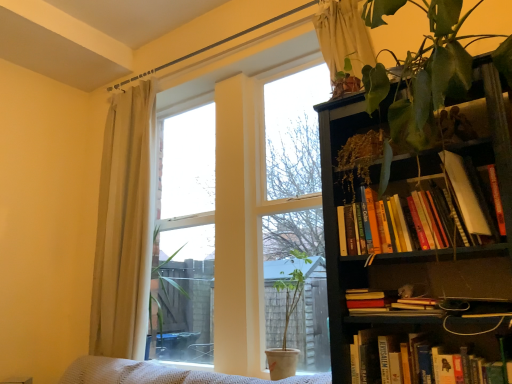
This screenshot has height=384, width=512. Describe the element at coordinates (343, 36) in the screenshot. I see `white sheer curtain at upper center, the second curtain from the left` at that location.

Image resolution: width=512 pixels, height=384 pixels. Describe the element at coordinates (287, 311) in the screenshot. I see `matte white pot at center` at that location.

The image size is (512, 384). What do you see at coordinates (124, 227) in the screenshot?
I see `beige fabric curtain at left, the first curtain from the left` at bounding box center [124, 227].

What do you see at coordinates (383, 356) in the screenshot? I see `hardcover book at lower right, which is the 2th book from top to bottom` at bounding box center [383, 356].

What do you see at coordinates (438, 216) in the screenshot? This screenshot has height=384, width=512. I see `hardcover books at upper right, the second book positioned from the bottom` at bounding box center [438, 216].

Where is `white sheer curtain at upper center, the 2th curtain when ordered from back to front`? white sheer curtain at upper center, the 2th curtain when ordered from back to front is located at coordinates (343, 36).

Which object is further away from the camera taking this photo, green leafy plant at upper right or beige fabric curtain at left, acting as the second curtain starting from the right?

beige fabric curtain at left, acting as the second curtain starting from the right, is further from the camera.

From a real-world perspective, is green leafy plant at upper right positioned over beige fabric curtain at left, acting as the second curtain starting from the right, based on gravity?

Yes, from a real-world perspective, green leafy plant at upper right is on top of beige fabric curtain at left, acting as the second curtain starting from the right.

Does point (403, 114) appear closer or farther from the camera than point (105, 290)?

Point (403, 114).

Is green leafy plant at upper right directly adjacent to beige fabric curtain at left, the second curtain in the front-to-back sequence?

No, green leafy plant at upper right is not touching beige fabric curtain at left, the second curtain in the front-to-back sequence.

Are beige fabric curtain at left, the first curtain from the left, and hardcover books at upper right, the second book positioned from the bottom, beside each other?

beige fabric curtain at left, the first curtain from the left, is not next to hardcover books at upper right, the second book positioned from the bottom, and they're not touching.

Does beige fabric curtain at left, acting as the second curtain starting from the right, have a greater height compared to hardcover books at upper right, the second book positioned from the bottom?

Indeed, beige fabric curtain at left, acting as the second curtain starting from the right, has a greater height compared to hardcover books at upper right, the second book positioned from the bottom.

Could you tell me if beige fabric curtain at left, acting as the second curtain starting from the right, is turned towards hardcover books at upper right, arranged as the 1th book when viewed from the top?

No, beige fabric curtain at left, acting as the second curtain starting from the right, does not turn towards hardcover books at upper right, arranged as the 1th book when viewed from the top.

Measure the distance from beige fabric curtain at left, the second curtain in the front-to-back sequence, to hardcover books at upper right, arranged as the 1th book when viewed from the top.

5.27 feet.

From the picture: Is transparent glass window at center wider than beige fabric curtain at left, the first curtain from the left?

Correct, the width of transparent glass window at center exceeds that of beige fabric curtain at left, the first curtain from the left.

From the image's perspective, between transparent glass window at center and beige fabric curtain at left, the first curtain from the left, which one is located above?

transparent glass window at center is shown above in the image.

Is the position of transparent glass window at center less distant than that of beige fabric curtain at left, the second curtain in the front-to-back sequence?

Yes, transparent glass window at center is closer to the camera.

Who is taller, transparent glass window at center or beige fabric curtain at left, the first curtain from the left?

Standing taller between the two is transparent glass window at center.

Considering the sizes of white sheer curtain at upper center, which ranks as the first curtain in front-to-back order, and transparent glass window at center in the image, is white sheer curtain at upper center, which ranks as the first curtain in front-to-back order, bigger or smaller than transparent glass window at center?

Considering their sizes, white sheer curtain at upper center, which ranks as the first curtain in front-to-back order, takes up less space than transparent glass window at center.

Which object is further away from the camera, white sheer curtain at upper center, which is the 1th curtain from right to left, or transparent glass window at center?

white sheer curtain at upper center, which is the 1th curtain from right to left, is further from the camera.

From a real-world perspective, which is physically below, white sheer curtain at upper center, the second curtain from the left, or transparent glass window at center?

In real-world perspective, transparent glass window at center is lower.

Does white sheer curtain at upper center, which ranks as the first curtain in front-to-back order, turn towards green leafy plant at upper right?

A: No, white sheer curtain at upper center, which ranks as the first curtain in front-to-back order, is not aimed at green leafy plant at upper right.

Is white sheer curtain at upper center, the second curtain from the left, wider than green leafy plant at upper right?

No.

Image resolution: width=512 pixels, height=384 pixels. Find the location of `curtain that is above the green leafy plant at upper right (from a real-world perspective)`. curtain that is above the green leafy plant at upper right (from a real-world perspective) is located at coordinates (343, 36).

Where is `bookcase on the right of transparent glass window at center`? bookcase on the right of transparent glass window at center is located at coordinates (421, 232).

Considering the relative sizes of transparent glass window at center and dark wood bookcase at right in the image provided, is transparent glass window at center thinner than dark wood bookcase at right?

Indeed, transparent glass window at center has a lesser width compared to dark wood bookcase at right.

From the image's perspective, which is below, transparent glass window at center or dark wood bookcase at right?

From the image's view, dark wood bookcase at right is below.

Between transparent glass window at center and dark wood bookcase at right, which one has smaller size?

dark wood bookcase at right.

Can you confirm if dark wood bookcase at right is wider than matte white pot at center?

Correct, the width of dark wood bookcase at right exceeds that of matte white pot at center.

Does dark wood bookcase at right come in front of matte white pot at center?

Yes, it is in front of matte white pot at center.

Is dark wood bookcase at right inside or outside of matte white pot at center?

dark wood bookcase at right is not enclosed by matte white pot at center.

Is dark wood bookcase at right facing away from matte white pot at center?

dark wood bookcase at right does not have its back to matte white pot at center.

At what (x,y) coordinates should I click in order to perform the action: click on the 2nd curtain counting from the left of the green leafy plant at upper right. Please return your answer as a coordinate pair (x, y). Image resolution: width=512 pixels, height=384 pixels. Looking at the image, I should click on (124, 227).

Find the location of a particular element. the 1st curtain located above the hardcover books at upper right, arranged as the 1th book when viewed from the top (from a real-world perspective) is located at coordinates (124, 227).

Considering their positions, is green leafy plant at upper right positioned further to white sheer curtain at upper center, the second curtain from the left, than dark wood bookcase at right?

The object further to white sheer curtain at upper center, the second curtain from the left, is dark wood bookcase at right.

Estimate the real-world distances between objects in this image. Which object is further from dark wood bookcase at right, green leafy plant at upper right or transparent glass window at center?

transparent glass window at center is further to dark wood bookcase at right.

When comparing their distances from dark wood bookcase at right, does beige fabric curtain at left, positioned as the 1th curtain in back-to-front order, or white sheer curtain at upper center, which is the 1th curtain from right to left, seem closer?

white sheer curtain at upper center, which is the 1th curtain from right to left, is positioned closer to the anchor dark wood bookcase at right.

From the image, which object appears to be nearer to beige fabric curtain at left, positioned as the 1th curtain in back-to-front order, transparent glass window at center or green leafy plant at upper right?

The object closer to beige fabric curtain at left, positioned as the 1th curtain in back-to-front order, is transparent glass window at center.

When comparing their distances from hardcover books at upper right, arranged as the 1th book when viewed from the top, does dark wood bookcase at right or matte white pot at center seem further?

matte white pot at center.

Based on their spatial positions, is beige fabric curtain at left, positioned as the 1th curtain in back-to-front order, or hardcover book at lower right, arranged as the first book when ordered from the bottom, closer to matte white pot at center?

hardcover book at lower right, arranged as the first book when ordered from the bottom, lies closer to matte white pot at center than the other object.

Which object lies further to the anchor point dark wood bookcase at right, white sheer curtain at upper center, which ranks as the first curtain in front-to-back order, or beige fabric curtain at left, the second curtain in the front-to-back sequence?

beige fabric curtain at left, the second curtain in the front-to-back sequence.

Based on their spatial positions, is beige fabric curtain at left, acting as the second curtain starting from the right, or green leafy plant at upper right further from hardcover book at lower right, which is the 2th book from top to bottom?

The object further to hardcover book at lower right, which is the 2th book from top to bottom, is beige fabric curtain at left, acting as the second curtain starting from the right.

I want to click on houseplant situated between beige fabric curtain at left, acting as the second curtain starting from the right, and dark wood bookcase at right from left to right, so coord(287,311).

Locate an element on the screen. This screenshot has height=384, width=512. window situated between beige fabric curtain at left, the second curtain in the front-to-back sequence, and green leafy plant at upper right from left to right is located at coordinates (241, 219).

Identify the location of houseplant between transparent glass window at center and hardcover books at upper right, arranged as the 1th book when viewed from the top, from left to right. (287, 311).

The height and width of the screenshot is (384, 512). Identify the location of houseplant between beige fabric curtain at left, the second curtain in the front-to-back sequence, and green leafy plant at upper right from left to right. (287, 311).